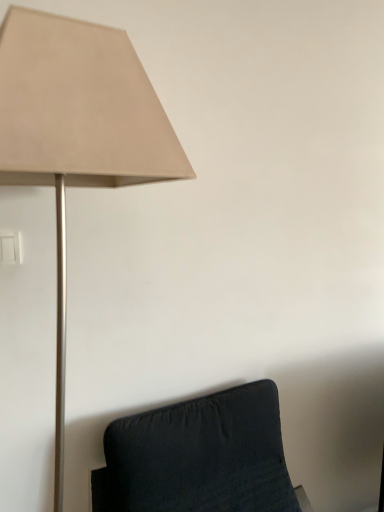
Question: Could velvet black cushion at lower right be considered to be inside beige fabric lampshade at upper left?

Choices:
 (A) no
 (B) yes

Answer: (A)

Question: Is beige fabric lampshade at upper left not inside velvet black cushion at lower right?

Choices:
 (A) no
 (B) yes

Answer: (B)

Question: From a real-world perspective, is beige fabric lampshade at upper left under velvet black cushion at lower right?

Choices:
 (A) no
 (B) yes

Answer: (A)

Question: Can you confirm if beige fabric lampshade at upper left is bigger than velvet black cushion at lower right?

Choices:
 (A) yes
 (B) no

Answer: (B)

Question: Is beige fabric lampshade at upper left touching velvet black cushion at lower right?

Choices:
 (A) yes
 (B) no

Answer: (B)

Question: Considering the relative sizes of beige fabric lampshade at upper left and velvet black cushion at lower right in the image provided, is beige fabric lampshade at upper left taller than velvet black cushion at lower right?

Choices:
 (A) yes
 (B) no

Answer: (A)

Question: Can you confirm if velvet black cushion at lower right is smaller than beige fabric lampshade at upper left?

Choices:
 (A) yes
 (B) no

Answer: (B)

Question: From a real-world perspective, is velvet black cushion at lower right on top of beige fabric lampshade at upper left?

Choices:
 (A) yes
 (B) no

Answer: (B)

Question: From a real-world perspective, does velvet black cushion at lower right sit lower than beige fabric lampshade at upper left?

Choices:
 (A) no
 (B) yes

Answer: (B)

Question: Can you confirm if velvet black cushion at lower right is wider than beige fabric lampshade at upper left?

Choices:
 (A) no
 (B) yes

Answer: (B)

Question: Is velvet black cushion at lower right at the left side of beige fabric lampshade at upper left?

Choices:
 (A) yes
 (B) no

Answer: (B)

Question: Is velvet black cushion at lower right looking in the opposite direction of beige fabric lampshade at upper left?

Choices:
 (A) no
 (B) yes

Answer: (A)

Question: In terms of height, does beige fabric lampshade at upper left look taller or shorter compared to velvet black cushion at lower right?

Choices:
 (A) short
 (B) tall

Answer: (B)